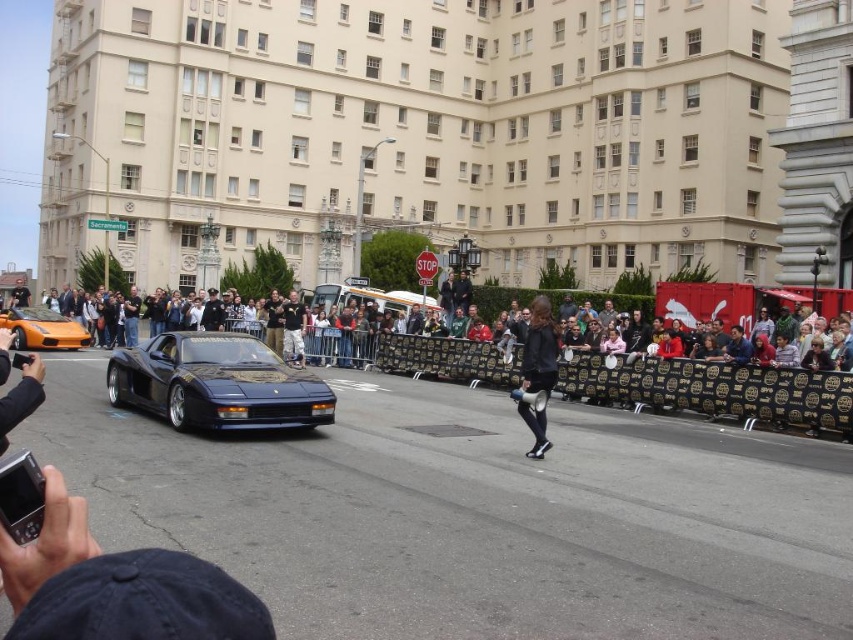
You are standing at the point with coordinates point (318,300) and want to move towards the point (6,317). According to the scene, will you be moving forward or backward?

Moving from point (318,300) to point (6,317) means moving closer to the viewer, so you are moving forward.

You are standing at the point with coordinates point (430,296) and want to walk to the point with coordinates point (549,442). Which direction should you move to reach your destination?

You should move forward because point (549,442) is in front of point (430,296).

You are a photographer positioned at the edge of the street. You need to capture both the orange matte sports car at left and the shiny silver van at center in a single shot. Based on their sizes, which vehicle should you focus on to ensure both are visible in the frame?

Since the orange matte sports car at left is smaller than the shiny silver van at center, you should focus on the shiny silver van at center to ensure both vehicles are visible in the frame.